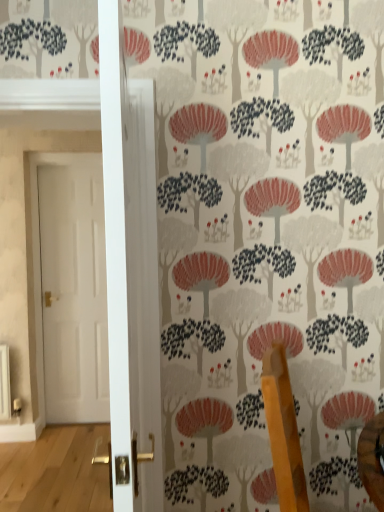
You are a GUI agent. You are given a task and a screenshot of the screen. Output one action in this format:
    pyautogui.click(x=<x>, y=<y>)
    Task: Click on the space that is in front of white glossy door at left
    The height and width of the screenshot is (512, 384).
    Given the screenshot: What is the action you would take?
    pyautogui.click(x=66, y=436)